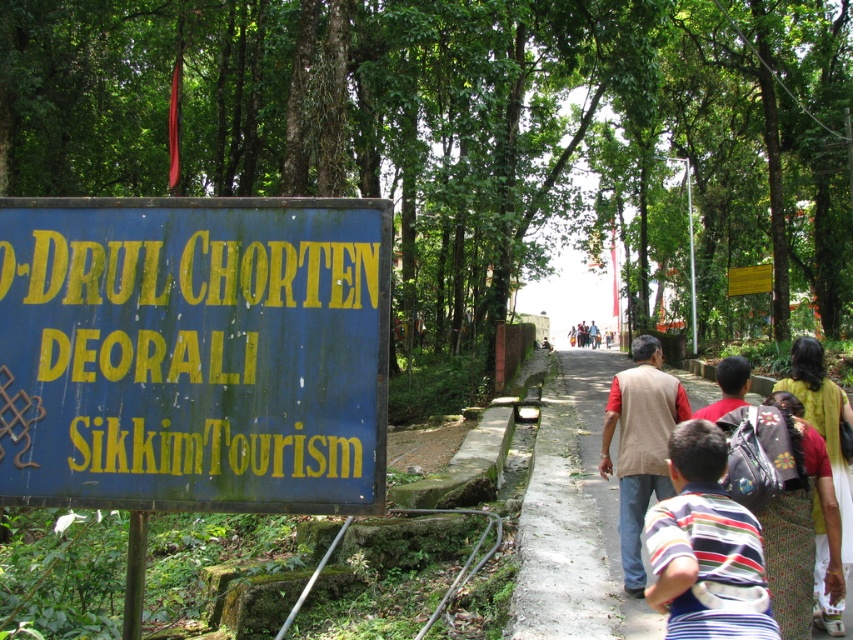
You are a tourist guide at Drul Chorten in Deorali, Sikkim. You notice a tourist wearing a yellow cotton saree at right and another tourist wearing a light blue shirt at center. Which tourist is positioned more to the left side of the path?

The yellow cotton saree at right is positioned more to the left side of the path than the light blue shirt at center.

You are a tourist standing at the entrance of Drul Chorten in Deorali, Sikkim. You see a concrete at center and a light blue shirt at center. Which object is bigger in size?

The concrete at center is larger in size than the light blue shirt at center.